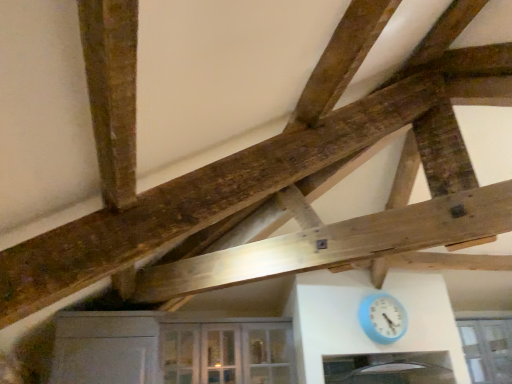
Image resolution: width=512 pixels, height=384 pixels. What do you see at coordinates (382, 318) in the screenshot?
I see `blue plastic clock at lower right` at bounding box center [382, 318].

The image size is (512, 384). I want to click on blue plastic clock at lower right, so click(x=382, y=318).

Is clear glass window at lower right in contact with clear glass cabinet at lower center?

No, clear glass window at lower right is not with clear glass cabinet at lower center.

From the image's perspective, which is below, clear glass window at lower right or clear glass cabinet at lower center?

clear glass window at lower right appears lower in the image.

Does blue plastic clock at lower right have a smaller size compared to clear glass window at lower right?

Yes.

In the image, is blue plastic clock at lower right on the left side or the right side of clear glass window at lower right?

blue plastic clock at lower right is positioned on clear glass window at lower right's left side.

Between blue plastic clock at lower right and clear glass window at lower right, which one is positioned behind?

clear glass window at lower right is behind.

Is blue plastic clock at lower right taller or shorter than clear glass window at lower right?

Clearly, blue plastic clock at lower right is shorter compared to clear glass window at lower right.

Which is closer, (221, 367) or (498, 371)?

Point (221, 367) appears to be closer to the viewer than point (498, 371).

Where is `cabinetry on the left of clear glass window at lower right`? Image resolution: width=512 pixels, height=384 pixels. cabinetry on the left of clear glass window at lower right is located at coordinates (170, 349).

Which object is positioned more to the left, clear glass cabinet at lower center or clear glass window at lower right?

From the viewer's perspective, clear glass cabinet at lower center appears more on the left side.

From a real-world perspective, who is located higher, clear glass cabinet at lower center or clear glass window at lower right?

From a 3D spatial view, clear glass cabinet at lower center is above.

Would you consider clear glass cabinet at lower center to be distant from blue plastic clock at lower right?

Absolutely, clear glass cabinet at lower center is distant from blue plastic clock at lower right.

Does point (256, 348) come closer to viewer compared to point (373, 339)?

No, it is not.

From the image's perspective, is clear glass cabinet at lower center on top of blue plastic clock at lower right?

No, from the image's perspective, clear glass cabinet at lower center is not above blue plastic clock at lower right.

Considering the sizes of objects clear glass cabinet at lower center and blue plastic clock at lower right in the image provided, who is taller, clear glass cabinet at lower center or blue plastic clock at lower right?

Standing taller between the two is clear glass cabinet at lower center.

Does point (399, 308) come in front of point (59, 317)?

That is False.

Considering the relative sizes of blue plastic clock at lower right and clear glass cabinet at lower center in the image provided, is blue plastic clock at lower right bigger than clear glass cabinet at lower center?

Incorrect, blue plastic clock at lower right is not larger than clear glass cabinet at lower center.

Is blue plastic clock at lower right wider than clear glass cabinet at lower center?

In fact, blue plastic clock at lower right might be narrower than clear glass cabinet at lower center.

Would you say clear glass cabinet at lower center is part of blue plastic clock at lower right's contents?

Actually, clear glass cabinet at lower center is outside blue plastic clock at lower right.

Between point (479, 381) and point (378, 313), which one is positioned in front?

The point (378, 313) is in front.

Considering the sizes of objects clear glass window at lower right and blue plastic clock at lower right in the image provided, who is thinner, clear glass window at lower right or blue plastic clock at lower right?

blue plastic clock at lower right.

From a real-world perspective, which object rests below the other?

clear glass window at lower right.

Where is `cabinetry above the clear glass window at lower right (from the image's perspective)`? cabinetry above the clear glass window at lower right (from the image's perspective) is located at coordinates (170, 349).

Locate an element on the screen. window located behind the blue plastic clock at lower right is located at coordinates (487, 349).

Based on their spatial positions, is clear glass window at lower right or clear glass cabinet at lower center further from blue plastic clock at lower right?

clear glass cabinet at lower center is further to blue plastic clock at lower right.

From the image, which object appears to be nearer to clear glass cabinet at lower center, blue plastic clock at lower right or clear glass window at lower right?

blue plastic clock at lower right lies closer to clear glass cabinet at lower center than the other object.

Looking at the image, which one is located closer to clear glass window at lower right, blue plastic clock at lower right or clear glass cabinet at lower center?

blue plastic clock at lower right is positioned closer to the anchor clear glass window at lower right.

Estimate the real-world distances between objects in this image. Which object is further from clear glass cabinet at lower center, clear glass window at lower right or blue plastic clock at lower right?

clear glass window at lower right is positioned further to the anchor clear glass cabinet at lower center.

When comparing their distances from clear glass window at lower right, does clear glass cabinet at lower center or blue plastic clock at lower right seem further?

clear glass cabinet at lower center is positioned further to the anchor clear glass window at lower right.

Estimate the real-world distances between objects in this image. Which object is further from blue plastic clock at lower right, clear glass cabinet at lower center or clear glass window at lower right?

The object further to blue plastic clock at lower right is clear glass cabinet at lower center.

At what (x,y) coordinates should I click in order to perform the action: click on clock situated between clear glass cabinet at lower center and clear glass window at lower right from left to right. Please return your answer as a coordinate pair (x, y). Looking at the image, I should click on [x=382, y=318].